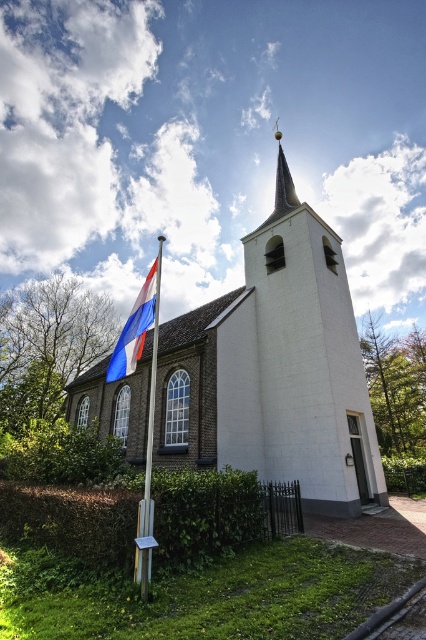
You are standing at the center of the image and want to find the green leafy hedge at lower left. In which direction should you look to locate it?

The green leafy hedge at lower left is located at point (71,518), so you should look towards the lower left direction to find it.